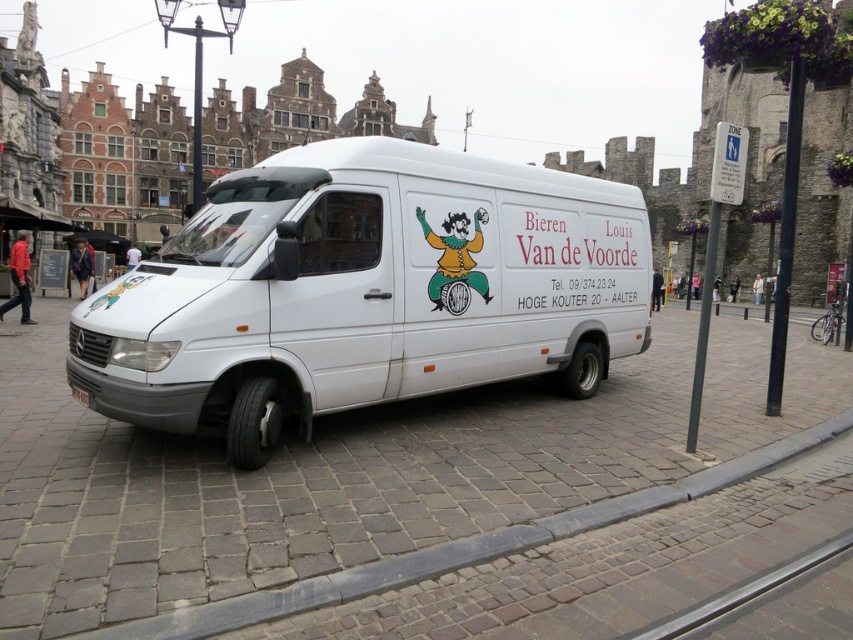
Question: Does white matte van at center appear on the left side of gray concrete curb at lower center?

Choices:
 (A) no
 (B) yes

Answer: (B)

Question: Does white matte van at center have a lesser width compared to gray concrete curb at lower center?

Choices:
 (A) yes
 (B) no

Answer: (B)

Question: Is white matte van at center closer to camera compared to gray concrete curb at lower center?

Choices:
 (A) no
 (B) yes

Answer: (A)

Question: Which point is farther to the camera?

Choices:
 (A) (694, 486)
 (B) (379, 173)

Answer: (B)

Question: Which object appears farthest from the camera in this image?

Choices:
 (A) gray concrete curb at lower center
 (B) white matte van at center

Answer: (B)